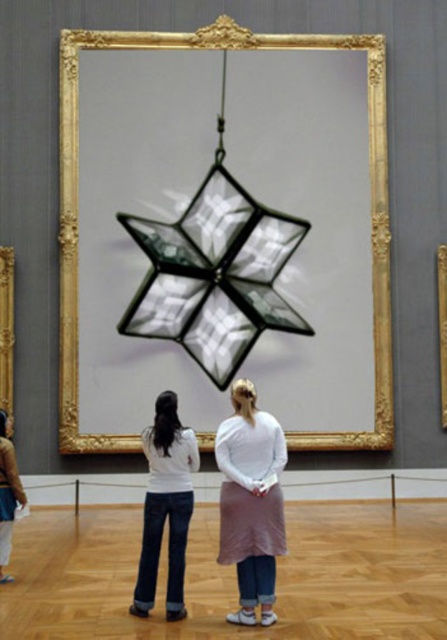
You are an art curator planning to install a new light source to highlight the star. You need to position the light so that it illuminates the point at position (251, 508) without affecting the point at (8, 316). Based on their spatial relationship, where should you place the light relative to these points?

The light should be placed in front of the point at (251, 508) because it is in front of the point at (8, 316). This way, the light will illuminate the closer point while the farther point remains unaffected.